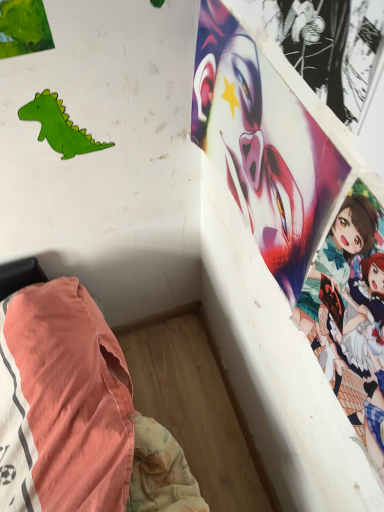
Describe the element at coordinates (59, 126) in the screenshot. This screenshot has width=384, height=512. I see `green matte paper dinosaur at upper left` at that location.

The width and height of the screenshot is (384, 512). In order to click on green matte paper dinosaur at upper left in this screenshot , I will do `click(59, 126)`.

Measure the distance between point (x=57, y=139) and camera.

Point (x=57, y=139) and camera are 77.30 centimeters apart from each other.

What do you see at coordinates (262, 151) in the screenshot? I see `smooth glossy poster at upper right` at bounding box center [262, 151].

Measure the distance between smooth glossy poster at upper right and camera.

smooth glossy poster at upper right is 17.73 inches away from camera.

This screenshot has width=384, height=512. In order to click on smooth glossy poster at upper right in this screenshot , I will do `click(262, 151)`.

Locate an element on the screen. green matte paper dinosaur at upper left is located at coordinates (59, 126).

Consider the image. Considering the relative positions of smooth glossy poster at upper right and green matte paper dinosaur at upper left in the image provided, is smooth glossy poster at upper right to the left of green matte paper dinosaur at upper left from the viewer's perspective?

No, smooth glossy poster at upper right is not to the left of green matte paper dinosaur at upper left.

Does smooth glossy poster at upper right come in front of green matte paper dinosaur at upper left?

Yes, smooth glossy poster at upper right is closer to the viewer.

Which is closer, (310, 206) or (56, 121)?

Point (310, 206)

From the image's perspective, would you say smooth glossy poster at upper right is shown under green matte paper dinosaur at upper left?

Correct, smooth glossy poster at upper right appears lower than green matte paper dinosaur at upper left in the image.

From a real-world perspective, between smooth glossy poster at upper right and green matte paper dinosaur at upper left, who is vertically higher?

From a 3D spatial view, smooth glossy poster at upper right is above.

Can you confirm if smooth glossy poster at upper right is wider than green matte paper dinosaur at upper left?

Correct, the width of smooth glossy poster at upper right exceeds that of green matte paper dinosaur at upper left.

In terms of height, does smooth glossy poster at upper right look taller or shorter compared to green matte paper dinosaur at upper left?

smooth glossy poster at upper right is taller than green matte paper dinosaur at upper left.

Considering the relative sizes of smooth glossy poster at upper right and green matte paper dinosaur at upper left in the image provided, is smooth glossy poster at upper right bigger than green matte paper dinosaur at upper left?

Yes.

Would you say green matte paper dinosaur at upper left is part of smooth glossy poster at upper right's contents?

No, green matte paper dinosaur at upper left is not inside smooth glossy poster at upper right.

Can you see smooth glossy poster at upper right touching green matte paper dinosaur at upper left?

No, smooth glossy poster at upper right is not next to green matte paper dinosaur at upper left.

Is green matte paper dinosaur at upper left at the back of smooth glossy poster at upper right?

No.

How many degrees apart are the facing directions of smooth glossy poster at upper right and green matte paper dinosaur at upper left?

The angle between the facing direction of smooth glossy poster at upper right and the facing direction of green matte paper dinosaur at upper left is 90.3 degrees.

Could you measure the distance between smooth glossy poster at upper right and green matte paper dinosaur at upper left?

smooth glossy poster at upper right and green matte paper dinosaur at upper left are 13.64 inches apart.

Where is `human face above the green matte paper dinosaur at upper left (from a real-world perspective)`? The image size is (384, 512). human face above the green matte paper dinosaur at upper left (from a real-world perspective) is located at coordinates (262, 151).

Is green matte paper dinosaur at upper left to the left or to the right of smooth glossy poster at upper right in the image?

green matte paper dinosaur at upper left is to the left of smooth glossy poster at upper right.

Considering the positions of objects green matte paper dinosaur at upper left and smooth glossy poster at upper right in the image provided, who is behind, green matte paper dinosaur at upper left or smooth glossy poster at upper right?

green matte paper dinosaur at upper left is further from the camera.

Is point (81, 135) closer to camera compared to point (227, 47)?

No, (81, 135) is further to viewer.

From the image's perspective, is green matte paper dinosaur at upper left located beneath smooth glossy poster at upper right?

No, from the image's perspective, green matte paper dinosaur at upper left is not below smooth glossy poster at upper right.

From a real-world perspective, between green matte paper dinosaur at upper left and smooth glossy poster at upper right, who is vertically higher?

smooth glossy poster at upper right.

Does green matte paper dinosaur at upper left have a greater width compared to smooth glossy poster at upper right?

Incorrect, the width of green matte paper dinosaur at upper left does not surpass that of smooth glossy poster at upper right.

Is green matte paper dinosaur at upper left taller or shorter than smooth glossy poster at upper right?

Considering their sizes, green matte paper dinosaur at upper left has less height than smooth glossy poster at upper right.

Considering the sizes of green matte paper dinosaur at upper left and smooth glossy poster at upper right in the image, is green matte paper dinosaur at upper left bigger or smaller than smooth glossy poster at upper right?

Considering their sizes, green matte paper dinosaur at upper left takes up less space than smooth glossy poster at upper right.

Is green matte paper dinosaur at upper left completely or partially outside of smooth glossy poster at upper right?

Indeed, green matte paper dinosaur at upper left is completely outside smooth glossy poster at upper right.

Are green matte paper dinosaur at upper left and smooth glossy poster at upper right far apart?

No, there isn't a large distance between green matte paper dinosaur at upper left and smooth glossy poster at upper right.

Could you tell me if green matte paper dinosaur at upper left is turned towards smooth glossy poster at upper right?

No, green matte paper dinosaur at upper left does not turn towards smooth glossy poster at upper right.

How distant is green matte paper dinosaur at upper left from smooth glossy poster at upper right?

green matte paper dinosaur at upper left and smooth glossy poster at upper right are 13.64 inches apart.

Identify the location of dinosaur located above the smooth glossy poster at upper right (from the image's perspective). (59, 126).

At what (x,y) coordinates should I click in order to perform the action: click on dinosaur directly beneath the smooth glossy poster at upper right (from a real-world perspective). Please return your answer as a coordinate pair (x, y). Looking at the image, I should click on tap(59, 126).

You are a GUI agent. You are given a task and a screenshot of the screen. Output one action in this format:
    pyautogui.click(x=<x>, y=<y>)
    Task: Click on the dinosaur above the smooth glossy poster at upper right (from the image's perspective)
    This screenshot has height=512, width=384.
    Given the screenshot: What is the action you would take?
    pyautogui.click(x=59, y=126)